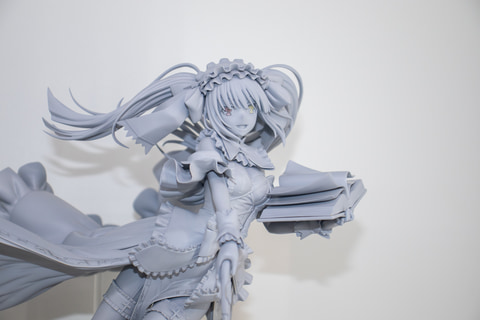
This screenshot has width=480, height=320. What are the coordinates of `open book` in the screenshot? It's located at (318, 182).